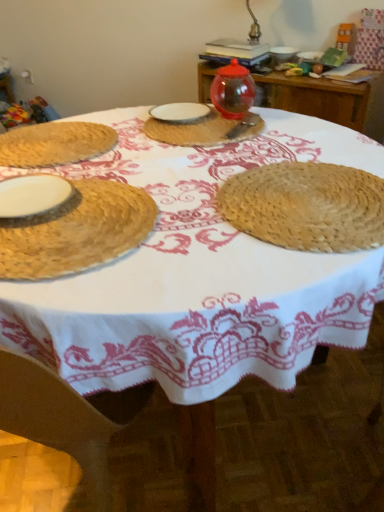
Question: Is white matte plate at left, which ranks as the 2th tableware in front-to-back order, thinner than natural straw placemat at left, which is the 1th tableware in bottom-to-top order?

Choices:
 (A) yes
 (B) no

Answer: (A)

Question: Does white matte plate at left, which ranks as the 2th tableware in front-to-back order, have a greater height compared to natural straw placemat at left, acting as the first tableware starting from the front?

Choices:
 (A) no
 (B) yes

Answer: (A)

Question: Is white matte plate at left, positioned as the fourth tableware in top-to-bottom order, located outside natural straw placemat at left, acting as the first tableware starting from the front?

Choices:
 (A) yes
 (B) no

Answer: (B)

Question: Can you confirm if white matte plate at left, which is the 4th tableware in back-to-front order, is smaller than natural straw placemat at left, which is the 5th tableware in back-to-front order?

Choices:
 (A) yes
 (B) no

Answer: (A)

Question: Are white matte plate at left, which ranks as the 2th tableware in front-to-back order, and natural straw placemat at left, acting as the first tableware starting from the front, located far from each other?

Choices:
 (A) yes
 (B) no

Answer: (B)

Question: Is natural straw placemat at left, which is counted as the fifth tableware, starting from the top, in front of or behind white ceramic plate at center, acting as the third tableware starting from the bottom, in the image?

Choices:
 (A) behind
 (B) front

Answer: (B)

Question: From the image's perspective, is natural straw placemat at left, which is the 5th tableware in back-to-front order, located above or below white ceramic plate at center, the 2th tableware viewed from the back?

Choices:
 (A) above
 (B) below

Answer: (B)

Question: Is natural straw placemat at left, which is the 5th tableware in back-to-front order, spatially inside white ceramic plate at center, the 2th tableware viewed from the back, or outside of it?

Choices:
 (A) inside
 (B) outside

Answer: (B)

Question: From a real-world perspective, relative to white ceramic plate at center, positioned as the third tableware in top-to-bottom order, is natural straw placemat at left, which is the 5th tableware in back-to-front order, vertically above or below?

Choices:
 (A) below
 (B) above

Answer: (B)

Question: From the image's perspective, is woven straw placemat at left, the second table viewed from the top, positioned above or below transparent glass jar at upper center, acting as the first tableware starting from the top?

Choices:
 (A) below
 (B) above

Answer: (A)

Question: From a real-world perspective, is woven straw placemat at left, which is the second table from right to left, above or below transparent glass jar at upper center, which is the fifth tableware from front to back?

Choices:
 (A) above
 (B) below

Answer: (B)

Question: Relative to transparent glass jar at upper center, which is counted as the 5th tableware, starting from the bottom, is woven straw placemat at left, arranged as the 1th table when viewed from the front, in front or behind?

Choices:
 (A) front
 (B) behind

Answer: (A)

Question: In terms of width, does woven straw placemat at left, which is the second table from right to left, look wider or thinner when compared to transparent glass jar at upper center, which is counted as the 5th tableware, starting from the bottom?

Choices:
 (A) wide
 (B) thin

Answer: (A)

Question: Considering the positions of white ceramic plate at center, acting as the third tableware starting from the bottom, and white matte plate at left, which ranks as the 2th tableware in front-to-back order, in the image, is white ceramic plate at center, acting as the third tableware starting from the bottom, wider or thinner than white matte plate at left, which ranks as the 2th tableware in front-to-back order,?

Choices:
 (A) wide
 (B) thin

Answer: (A)

Question: From the image's perspective, relative to white matte plate at left, positioned as the fourth tableware in top-to-bottom order, is white ceramic plate at center, positioned as the fourth tableware in front-to-back order, above or below?

Choices:
 (A) above
 (B) below

Answer: (A)